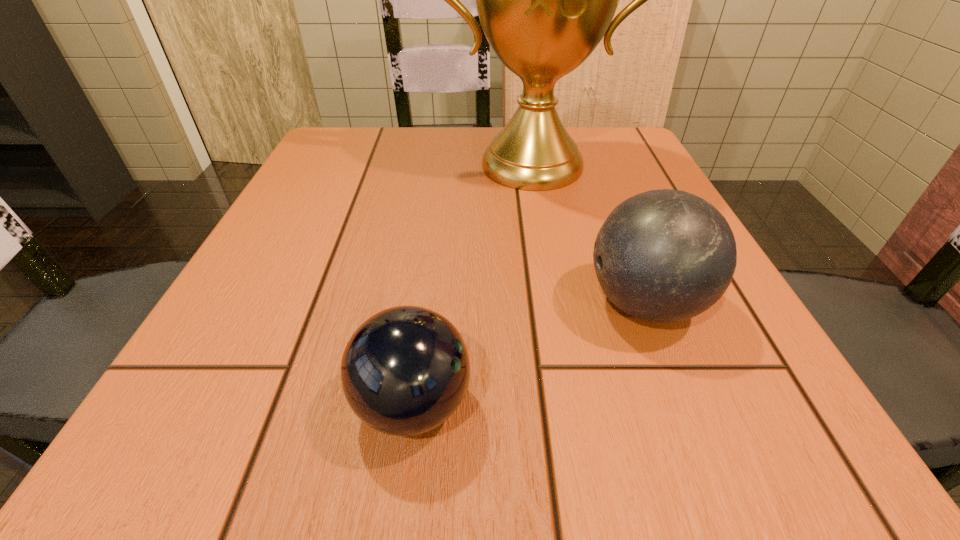
The height and width of the screenshot is (540, 960). In order to click on the farthest object in this screenshot , I will do `click(545, 0)`.

At what (x,y) coordinates should I click in order to perform the action: click on the tallest object. Please return your answer as a coordinate pair (x, y). The width and height of the screenshot is (960, 540). Looking at the image, I should click on (545, 0).

Identify the location of the taller bowling ball. The image size is (960, 540). (665, 255).

Find the location of a particular element. the farther bowling ball is located at coordinates (665, 255).

The image size is (960, 540). I want to click on the shortest object, so click(405, 370).

Where is `the nearest object`? the nearest object is located at coordinates coord(405,370).

Locate an element on the screen. blank area located 0.110m on the surface of the farthest object with symbols is located at coordinates (544, 231).

The image size is (960, 540). In order to click on vacant space located on the grip area of the second nearest object in this screenshot , I will do `click(473, 303)`.

Locate an element on the screen. vacant point located 0.240m on the grip area of the second nearest object is located at coordinates (418, 303).

Locate an element on the screen. The height and width of the screenshot is (540, 960). vacant space located 0.310m on the grip area of the second nearest object is located at coordinates (369, 303).